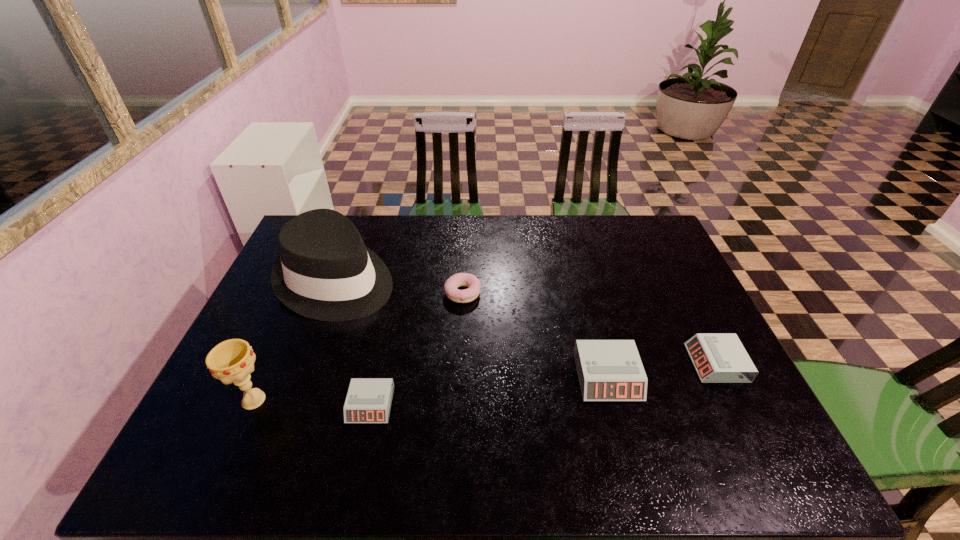
Locate an element on the screen. the leftmost alarm clock is located at coordinates (368, 400).

Find the location of a particular element. the shortest object is located at coordinates (368, 400).

Where is `the tallest alarm clock`? Image resolution: width=960 pixels, height=540 pixels. the tallest alarm clock is located at coordinates (608, 370).

Find the location of a particular element. This screenshot has height=540, width=960. the second alarm clock from right to left is located at coordinates (608, 370).

Locate an element on the screen. This screenshot has height=540, width=960. the rightmost alarm clock is located at coordinates (717, 357).

In order to click on the second tallest alarm clock in this screenshot , I will do `click(717, 357)`.

Locate an element on the screen. doughnut is located at coordinates (457, 280).

This screenshot has width=960, height=540. I want to click on fedora, so click(325, 272).

Locate an element on the screen. The height and width of the screenshot is (540, 960). chalice is located at coordinates (232, 361).

The height and width of the screenshot is (540, 960). Identify the location of free location located 0.080m on the back of the leftmost alarm clock. (380, 360).